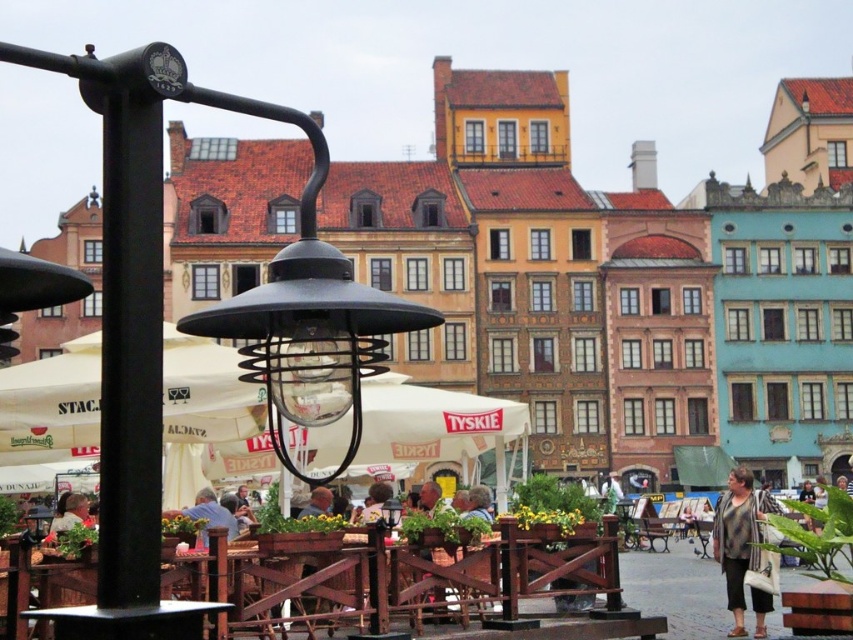
Question: Among these points, which one is farthest from the camera?

Choices:
 (A) (283, 449)
 (B) (732, 506)

Answer: (B)

Question: Which object appears farthest from the camera in this image?

Choices:
 (A) wooden table at lower left
 (B) black matte lamp post at left
 (C) black matte pole at left

Answer: (C)

Question: Is black matte lamp post at left behind wooden table at lower left?

Choices:
 (A) yes
 (B) no

Answer: (B)

Question: Does wooden table at lower left have a greater width compared to black matte pole at left?

Choices:
 (A) no
 (B) yes

Answer: (B)

Question: Which is farther from the black matte pole at left?

Choices:
 (A) wooden table at lower left
 (B) black matte lamp post at left

Answer: (A)

Question: In this image, where is wooden table at lower left located relative to black matte pole at left?

Choices:
 (A) left
 (B) right

Answer: (B)